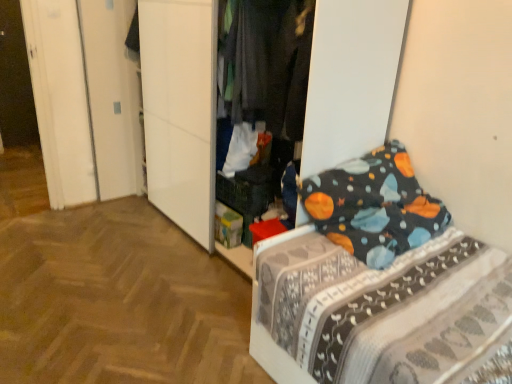
Describe the element at coordinates (268, 63) in the screenshot. I see `dark gray fabric pants at center` at that location.

You are a GUI agent. You are given a task and a screenshot of the screen. Output one action in this format:
    pyautogui.click(x=<x>, y=<y>)
    Task: Click on the dark gray fabric pants at center
    The width and height of the screenshot is (512, 384).
    Given the screenshot: What is the action you would take?
    click(x=268, y=63)

Measure the distance between dark blue fabric bed at right and camera.

dark blue fabric bed at right is 1.25 meters from camera.

What do you see at coordinates (379, 284) in the screenshot? I see `dark blue fabric bed at right` at bounding box center [379, 284].

The image size is (512, 384). I want to click on dark blue fabric bed at right, so click(x=379, y=284).

Locate an element on the screen. This screenshot has width=512, height=384. dark gray fabric pants at center is located at coordinates (268, 63).

Does dark gray fabric pants at center appear on the right side of dark blue fabric bed at right?

In fact, dark gray fabric pants at center is to the left of dark blue fabric bed at right.

Is dark gray fabric pants at center behind dark blue fabric bed at right?

Yes, dark gray fabric pants at center is behind dark blue fabric bed at right.

Considering the points (304, 119) and (396, 233), which point is behind, point (304, 119) or point (396, 233)?

Positioned behind is point (304, 119).

From the image's perspective, is dark gray fabric pants at center above dark blue fabric bed at right?

Indeed, from the image's perspective, dark gray fabric pants at center is shown above dark blue fabric bed at right.

From a real-world perspective, is dark gray fabric pants at center physically below dark blue fabric bed at right?

No.

Which of these two, dark gray fabric pants at center or dark blue fabric bed at right, is wider?

dark blue fabric bed at right.

Considering the relative sizes of dark gray fabric pants at center and dark blue fabric bed at right in the image provided, is dark gray fabric pants at center taller than dark blue fabric bed at right?

Yes.

From the picture: Between dark gray fabric pants at center and dark blue fabric bed at right, which one has larger size?

dark blue fabric bed at right is bigger.

Would you say dark gray fabric pants at center is inside or outside dark blue fabric bed at right?

dark gray fabric pants at center is located beyond the bounds of dark blue fabric bed at right.

Are dark gray fabric pants at center and dark blue fabric bed at right making contact?

No, dark gray fabric pants at center is not beside dark blue fabric bed at right.

Is dark gray fabric pants at center aimed at dark blue fabric bed at right?

No, dark gray fabric pants at center is not oriented towards dark blue fabric bed at right.

How different are the orientations of dark gray fabric pants at center and dark blue fabric bed at right in degrees?

The angle between the facing direction of dark gray fabric pants at center and the facing direction of dark blue fabric bed at right is 89.2 degrees.

Where is `bed in front of the dark gray fabric pants at center`? The height and width of the screenshot is (384, 512). bed in front of the dark gray fabric pants at center is located at coordinates (379, 284).

Is dark blue fabric bed at right to the left or to the right of dark gray fabric pants at center in the image?

dark blue fabric bed at right is positioned on dark gray fabric pants at center's right side.

Is dark blue fabric bed at right closer to the viewer compared to dark gray fabric pants at center?

Yes, the depth of dark blue fabric bed at right is less than that of dark gray fabric pants at center.

Which is less distant, (466, 279) or (304, 106)?

Point (466, 279) is closer to the camera than point (304, 106).

From the image's perspective, is dark blue fabric bed at right above or below dark gray fabric pants at center?

Clearly, from the image's perspective, dark blue fabric bed at right is below dark gray fabric pants at center.

From a real-world perspective, is dark blue fabric bed at right positioned above or below dark gray fabric pants at center?

Clearly, from a real-world perspective, dark blue fabric bed at right is below dark gray fabric pants at center.

Does dark blue fabric bed at right have a lesser width compared to dark gray fabric pants at center?

No, dark blue fabric bed at right is not thinner than dark gray fabric pants at center.

Is dark blue fabric bed at right taller than dark gray fabric pants at center?

No, dark blue fabric bed at right is not taller than dark gray fabric pants at center.

Between dark blue fabric bed at right and dark gray fabric pants at center, which one has larger size?

dark blue fabric bed at right is bigger.

Do you think dark blue fabric bed at right is within dark gray fabric pants at center, or outside of it?

dark blue fabric bed at right exists outside the volume of dark gray fabric pants at center.

Is dark blue fabric bed at right not near dark gray fabric pants at center?

Actually, dark blue fabric bed at right and dark gray fabric pants at center are a little close together.

Is dark blue fabric bed at right facing away from dark gray fabric pants at center?

That's not correct — dark blue fabric bed at right is not looking away from dark gray fabric pants at center.

This screenshot has height=384, width=512. Find the location of `bed below the dark gray fabric pants at center (from a real-world perspective)`. bed below the dark gray fabric pants at center (from a real-world perspective) is located at coordinates (379, 284).

In order to click on bed located in front of the dark gray fabric pants at center in this screenshot , I will do `click(379, 284)`.

Where is `clothing that is above the dark blue fabric bed at right (from a real-world perspective)`? The width and height of the screenshot is (512, 384). clothing that is above the dark blue fabric bed at right (from a real-world perspective) is located at coordinates coord(268,63).